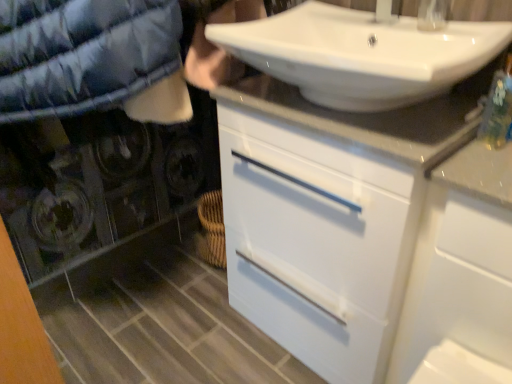
Question: Would you say white glossy cabinet at center is outside white glossy cabinet at upper right?

Choices:
 (A) yes
 (B) no

Answer: (A)

Question: Can you confirm if white glossy cabinet at center is positioned to the right of white glossy cabinet at upper right?

Choices:
 (A) no
 (B) yes

Answer: (A)

Question: From the image's perspective, is white glossy cabinet at center over white glossy cabinet at upper right?

Choices:
 (A) no
 (B) yes

Answer: (B)

Question: From the image's perspective, is white glossy cabinet at center located beneath white glossy cabinet at upper right?

Choices:
 (A) yes
 (B) no

Answer: (B)

Question: Considering the relative sizes of white glossy cabinet at center and white glossy cabinet at upper right in the image provided, is white glossy cabinet at center wider than white glossy cabinet at upper right?

Choices:
 (A) no
 (B) yes

Answer: (B)

Question: Does white glossy cabinet at center have a greater height compared to white glossy cabinet at upper right?

Choices:
 (A) yes
 (B) no

Answer: (A)

Question: Can you confirm if white glossy cabinet at upper right is thinner than white glossy sink at upper center?

Choices:
 (A) no
 (B) yes

Answer: (B)

Question: From the image's perspective, is white glossy cabinet at upper right located beneath white glossy sink at upper center?

Choices:
 (A) no
 (B) yes

Answer: (B)

Question: Does white glossy cabinet at upper right turn towards white glossy sink at upper center?

Choices:
 (A) yes
 (B) no

Answer: (B)

Question: Can white glossy sink at upper center be found inside white glossy cabinet at upper right?

Choices:
 (A) yes
 (B) no

Answer: (B)

Question: Can you confirm if white glossy cabinet at upper right is taller than white glossy sink at upper center?

Choices:
 (A) yes
 (B) no

Answer: (A)

Question: From a real-world perspective, is white glossy cabinet at upper right positioned over white glossy sink at upper center based on gravity?

Choices:
 (A) no
 (B) yes

Answer: (A)

Question: Is there a large distance between white glossy faucet at upper center and white glossy cabinet at center?

Choices:
 (A) no
 (B) yes

Answer: (A)